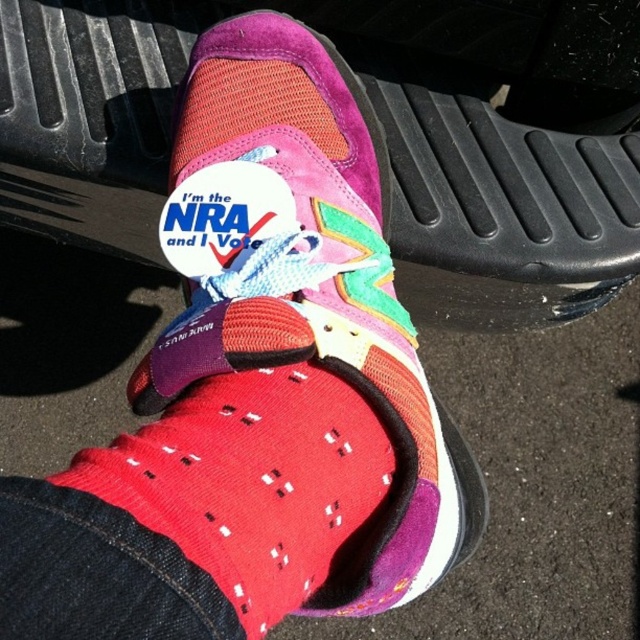
You are a driver sitting in the driver seat. You see two points on the pedals. The first point is at coordinate point (256, 122) and the second is at point (157, 525). Which pedal is closer to you, the first or the second?

Point (256, 122) is behind point (157, 525), so the second pedal at point (157, 525) is closer to you.